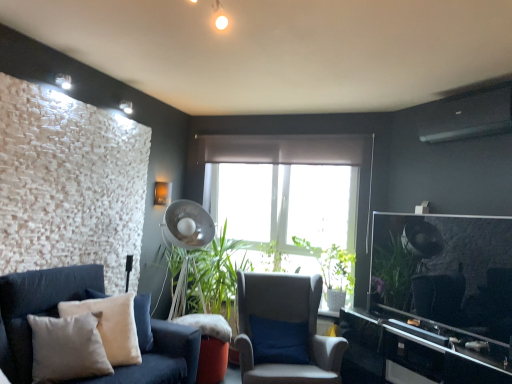
Question: Considering the relative positions of green matte plant at center and beige velvet pillow at lower left in the image provided, is green matte plant at center to the left or to the right of beige velvet pillow at lower left?

Choices:
 (A) left
 (B) right

Answer: (B)

Question: Is green matte plant at center wider or thinner than beige velvet pillow at lower left?

Choices:
 (A) thin
 (B) wide

Answer: (B)

Question: Which is farther from the green matte plant at center?

Choices:
 (A) beige velvet pillow at lower left
 (B) white sheer curtain at center
 (C) black glossy entertainment center at right
 (D) metallic silver mechanical fan at center
 (E) light gray fabric chair at center

Answer: (A)

Question: Considering the real-world distances, which object is farthest from the black glossy entertainment center at right?

Choices:
 (A) light gray fabric chair at center
 (B) green matte plant at center
 (C) soft cotton couch at lower left
 (D) beige velvet pillow at lower left
 (E) white sheer curtain at center

Answer: (C)